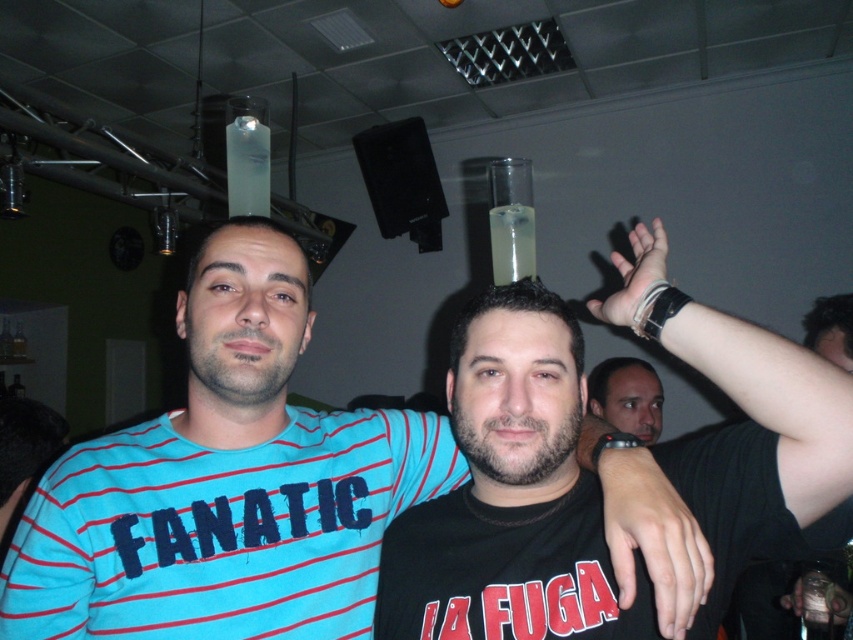
Question: Which object appears farthest from the camera in this image?

Choices:
 (A) smooth skin face at center
 (B) black matte shirt at center

Answer: (A)

Question: In this image, where is black matte shirt at center located relative to smooth skin face at center?

Choices:
 (A) above
 (B) below

Answer: (A)

Question: Is black matte shirt at center closer to camera compared to smooth skin face at center?

Choices:
 (A) no
 (B) yes

Answer: (B)

Question: Can you confirm if black matte shirt at center is smaller than smooth skin face at center?

Choices:
 (A) yes
 (B) no

Answer: (B)